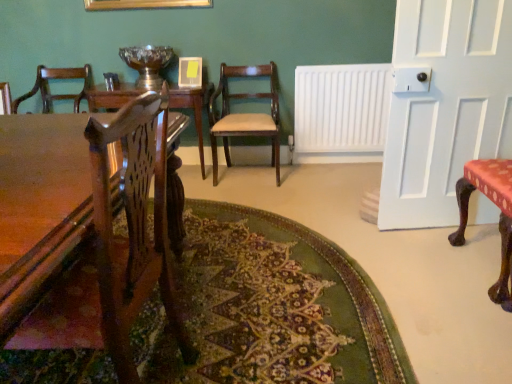
Where is `free space between white painted wood door at right and red fabric-covered chair at right, the 2th chair in the left-to-right sequence`? free space between white painted wood door at right and red fabric-covered chair at right, the 2th chair in the left-to-right sequence is located at coordinates (435, 246).